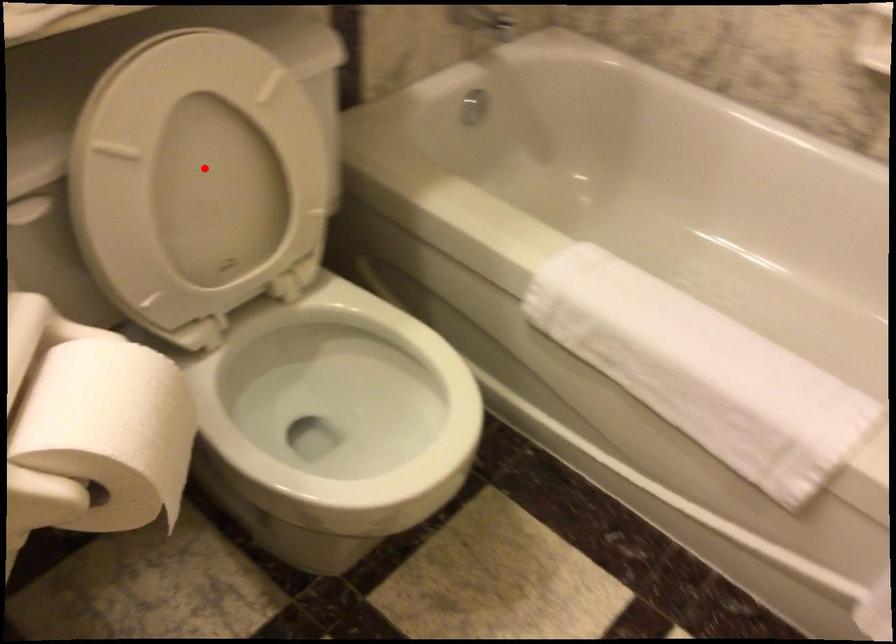
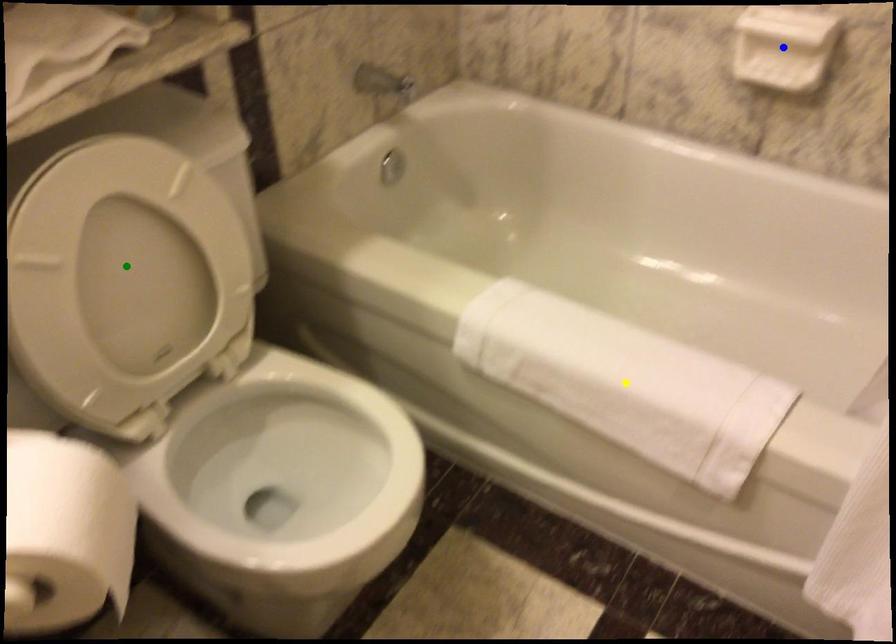
Question: I am providing you with two images of the same scene from different viewpoints. A red point is marked on the first image. You are given multiple points on the second image. Which point in image 2 represents the same 3d spot as the red point in image 1?

Choices:
 (A) yellow point
 (B) green point
 (C) blue point

Answer: (B)